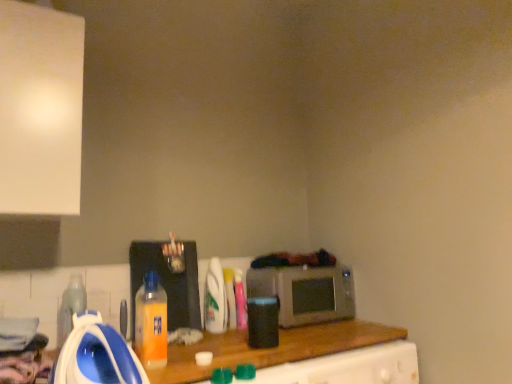
Question: Is orange plastic bottle at center, which is counted as the second bottle, starting from the left, closer to the viewer compared to translucent plastic bottle at lower left, the fourth bottle in the back-to-front sequence?

Choices:
 (A) no
 (B) yes

Answer: (B)

Question: Considering the relative sizes of orange plastic bottle at center, the 4th bottle from the right, and translucent plastic bottle at lower left, the fourth bottle in the back-to-front sequence, in the image provided, is orange plastic bottle at center, the 4th bottle from the right, wider than translucent plastic bottle at lower left, the fourth bottle in the back-to-front sequence,?

Choices:
 (A) no
 (B) yes

Answer: (A)

Question: Can you confirm if orange plastic bottle at center, acting as the fifth bottle starting from the back, is taller than translucent plastic bottle at lower left, which is the first bottle from left to right?

Choices:
 (A) no
 (B) yes

Answer: (B)

Question: Are orange plastic bottle at center, which is counted as the 1th bottle, starting from the front, and translucent plastic bottle at lower left, the fourth bottle in the back-to-front sequence, far apart?

Choices:
 (A) yes
 (B) no

Answer: (B)

Question: Does orange plastic bottle at center, which is counted as the second bottle, starting from the left, turn towards translucent plastic bottle at lower left, the fourth bottle in the back-to-front sequence?

Choices:
 (A) no
 (B) yes

Answer: (A)

Question: In terms of height, does translucent plastic bottle at lower left, which is the second bottle from front to back, look taller or shorter compared to orange plastic bottle at center, which is counted as the 1th bottle, starting from the front?

Choices:
 (A) short
 (B) tall

Answer: (A)

Question: Considering the positions of point (82, 301) and point (152, 326), is point (82, 301) closer or farther from the camera than point (152, 326)?

Choices:
 (A) farther
 (B) closer

Answer: (A)

Question: Do you think translucent plastic bottle at lower left, which is the second bottle from front to back, is within orange plastic bottle at center, acting as the fifth bottle starting from the back, or outside of it?

Choices:
 (A) outside
 (B) inside

Answer: (A)

Question: Is translucent plastic bottle at lower left, which is the second bottle from front to back, bigger or smaller than orange plastic bottle at center, acting as the fifth bottle starting from the back?

Choices:
 (A) small
 (B) big

Answer: (B)

Question: From the image's perspective, is metallic silver microwave at center above or below translucent plastic bottle at center, arranged as the 3th bottle when viewed from the back?

Choices:
 (A) below
 (B) above

Answer: (A)

Question: From their relative heights in the image, would you say metallic silver microwave at center is taller or shorter than translucent plastic bottle at center, which is counted as the third bottle, starting from the right?

Choices:
 (A) tall
 (B) short

Answer: (B)

Question: From a real-world perspective, is metallic silver microwave at center above or below translucent plastic bottle at center, the third bottle from the left?

Choices:
 (A) above
 (B) below

Answer: (B)

Question: Is metallic silver microwave at center inside the boundaries of translucent plastic bottle at center, which is counted as the third bottle, starting from the right, or outside?

Choices:
 (A) outside
 (B) inside

Answer: (A)

Question: Would you say translucent plastic bottle at center, arranged as the second appliance when viewed from the front, is to the left or to the right of translucent plastic bottle at center, the third bottle from the left, in the picture?

Choices:
 (A) left
 (B) right

Answer: (A)

Question: Is point (192, 294) positioned closer to the camera than point (205, 317)?

Choices:
 (A) farther
 (B) closer

Answer: (A)